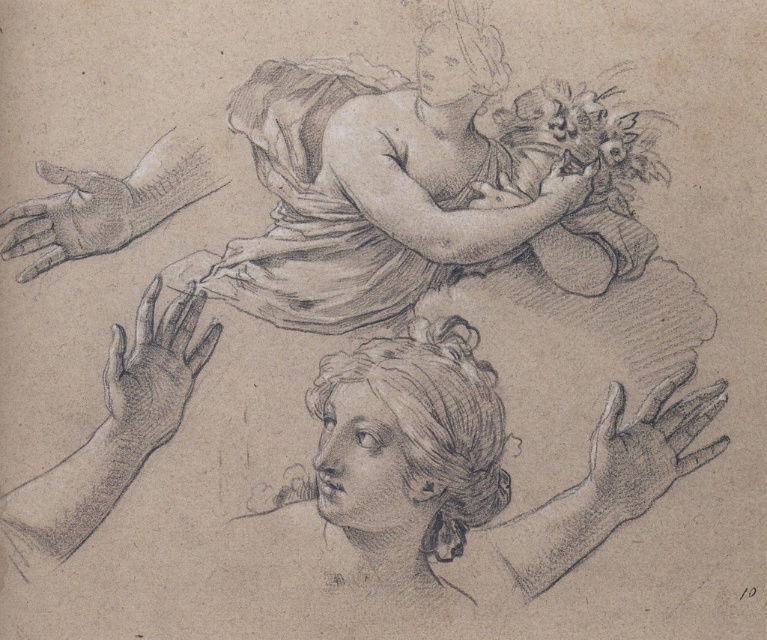
This screenshot has height=640, width=767. What are the coordinates of `smooth fabric head at upper center` in the screenshot? It's located at (288, 118).

Find the location of a particular element. smooth fabric head at upper center is located at coordinates (288, 118).

The image size is (767, 640). I want to click on smooth fabric head at upper center, so click(x=288, y=118).

Can you confirm if smooth gray hand at lower left is smaller than smooth skin hand at upper center?

No.

Who is shorter, smooth gray hand at lower left or smooth skin hand at upper center?

Standing shorter between the two is smooth skin hand at upper center.

Measure the distance between point (153, 436) and camera.

The distance of point (153, 436) from camera is 9.78 feet.

Find the location of `smooth gray hand at lower left`. smooth gray hand at lower left is located at coordinates (153, 372).

Which is more to the right, smooth gray hair at lower center or smooth gray glove at left?

From the viewer's perspective, smooth gray hair at lower center appears more on the right side.

Between point (448, 387) and point (71, 204), which one is positioned in front?

Positioned in front is point (448, 387).

Where is `smooth gray hair at lower center`? smooth gray hair at lower center is located at coordinates (433, 420).

Find the location of a particular element. This screenshot has height=640, width=767. smooth gray hair at lower center is located at coordinates (433, 420).